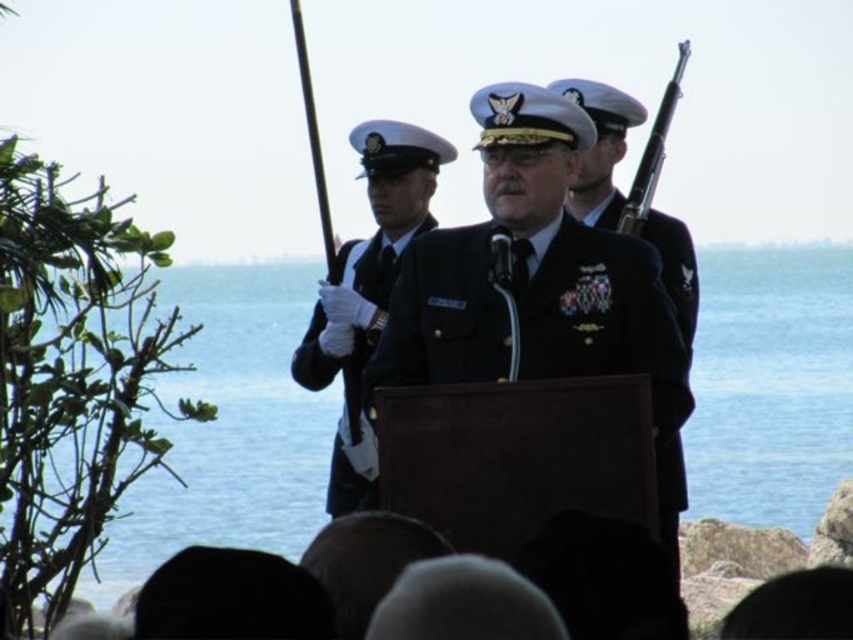
You are a photographer positioned at the edge of the scene. You need to capture a closeup shot of the blue water at center. Which direction should you move to get closer to it?

The blue water at center is located at point (230, 428), so you should move towards the center of the scene to get closer to it.

You are attending a military ceremony and want to take a photo of the two points mentioned. Which point is closer to you, point [650,253] or point [306,385]?

Point [650,253] is closer to the viewer than point [306,385].

You are a photographer at the event and need to capture a photo where both the blue water at center and the black polished rifle at upper right are visible. Considering their sizes, which object should you ensure is within the camera frame first?

The blue water at center is larger in size than the black polished rifle at upper right, so you should ensure the blue water at center is within the camera frame first to accommodate its larger size.